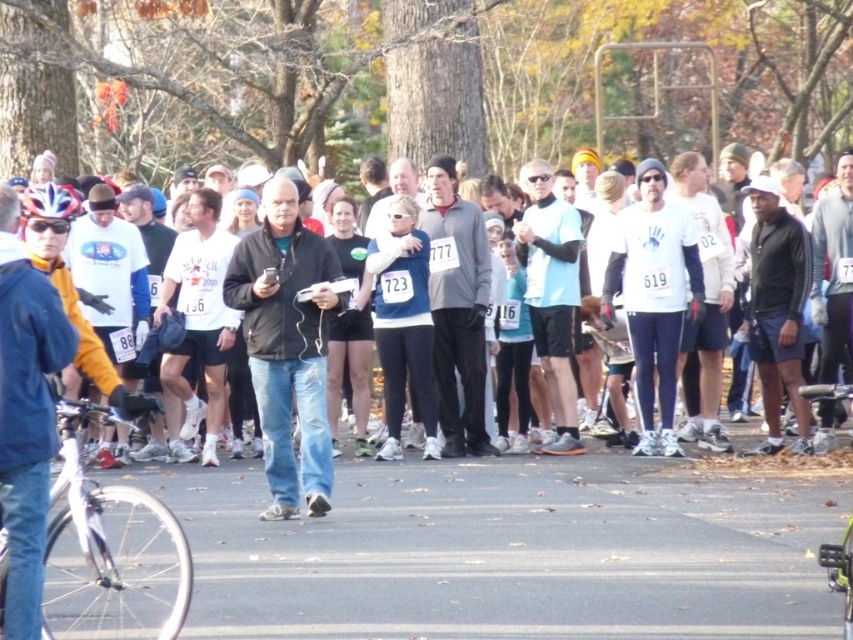
Is white matte bicycle at lower left positioned behind green matte bicycle at lower right?

Yes, white matte bicycle at lower left is behind green matte bicycle at lower right.

Which is in front, point (48, 588) or point (850, 636)?

Positioned in front is point (850, 636).

Find the location of a particular element. The image size is (853, 640). white matte bicycle at lower left is located at coordinates (109, 552).

Where is `white matte bicycle at lower left`? The image size is (853, 640). white matte bicycle at lower left is located at coordinates (109, 552).